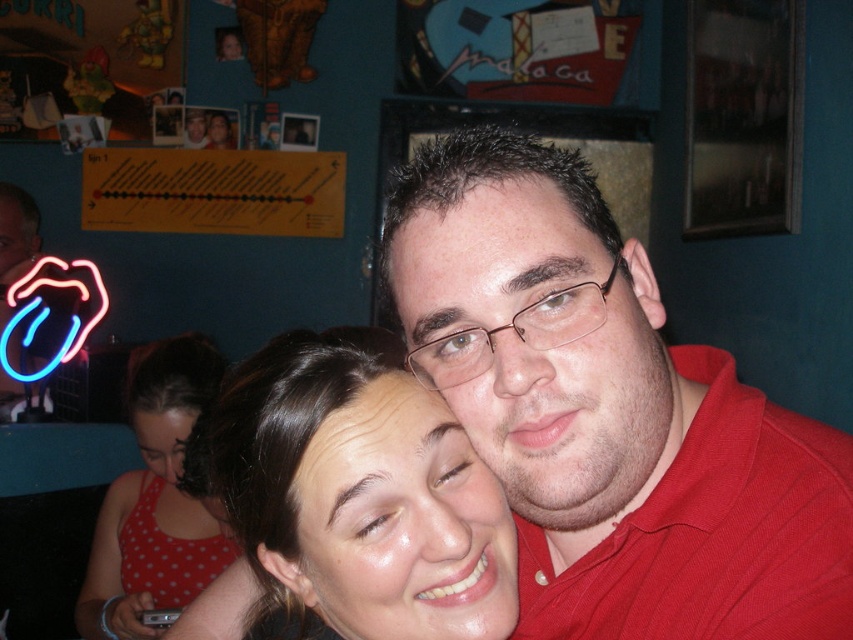
Based on the photo, you are standing in front of a dress rack at a store and see the polka dot fabric dress at lower left. If you want to reach it without moving your feet, can you do it?

The polka dot fabric dress at lower left is 4.15 feet away from viewer, so you cannot reach it without moving your feet since the average arm length is about 2.5 feet.

You are a photographer adjusting the camera to focus on two points in the image. The first point is labeled as point [578,339] and the second is point [502,506]. Since the photographer wants to ensure the subject closest to the camera is in focus, which point should you prioritize focusing on?

Point [578,339] is in front of point [502,506], so you should prioritize focusing on point [578,339] since it is closer to the camera.

Looking at this image, you are a photographer who wants to ensure the matte red shirt at center and the smooth skin face at center are both clearly visible in the photo. Based on their positions, which one might be more likely to block the other from view?

The matte red shirt at center is in front of the smooth skin face at center, so it might block the smooth skin face at center from view.